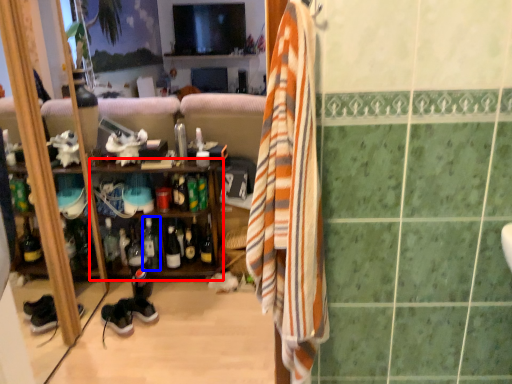
Question: Which of the following is the farthest to the observer, shelf (highlighted by a red box) or bottle (highlighted by a blue box)?

Choices:
 (A) shelf
 (B) bottle

Answer: (B)